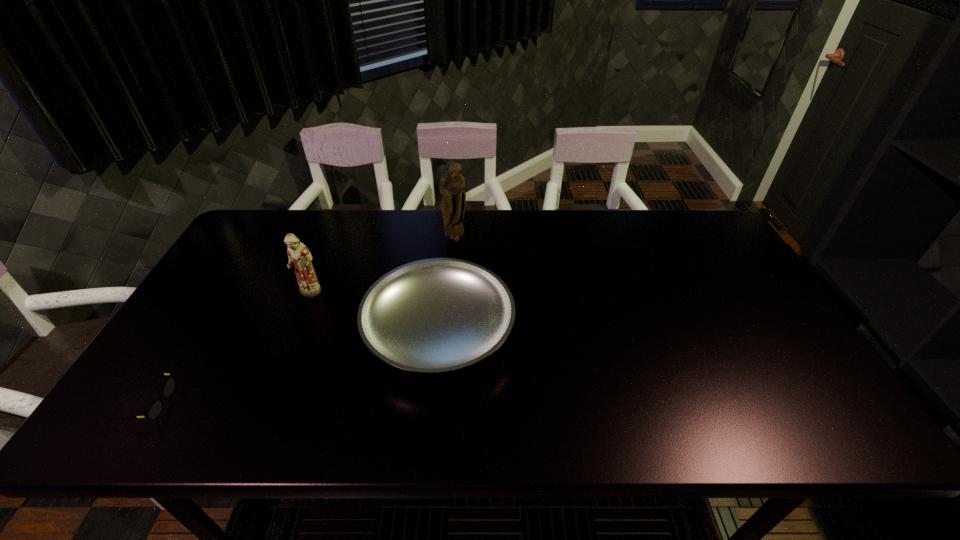
You are a GUI agent. You are given a task and a screenshot of the screen. Output one action in this format:
    pyautogui.click(x=<x>, y=<y>)
    Task: Click on the right figurine
    
    Given the screenshot: What is the action you would take?
    pyautogui.click(x=452, y=184)

Locate an element on the screen. This screenshot has height=540, width=960. the farther figurine is located at coordinates (452, 184).

Locate an element on the screen. The height and width of the screenshot is (540, 960). the left figurine is located at coordinates 299,256.

Identify the location of the nearer figurine. (299, 256).

This screenshot has height=540, width=960. Find the location of `the third tallest object`. the third tallest object is located at coordinates (436, 315).

Locate an element on the screen. the shortest object is located at coordinates (154, 410).

Locate an element on the screen. spectacles is located at coordinates (154, 410).

Identify the location of free space located 0.160m on the front-facing side of the farthest object. (453, 275).

The width and height of the screenshot is (960, 540). In order to click on vacant space located 0.310m on the front-facing side of the shorter figurine in this screenshot , I will do `click(266, 399)`.

Identify the location of free region located 0.330m on the back of the third tallest object. (449, 216).